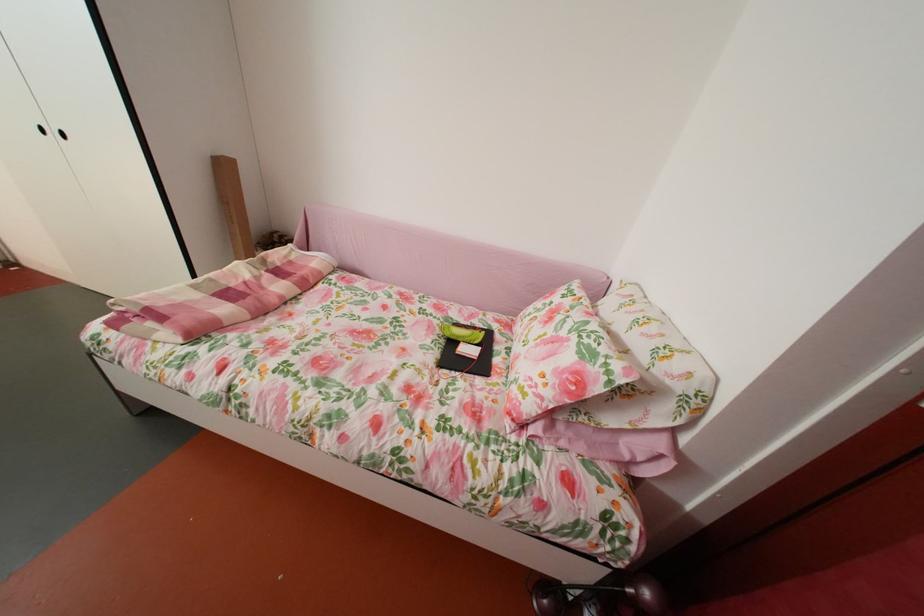
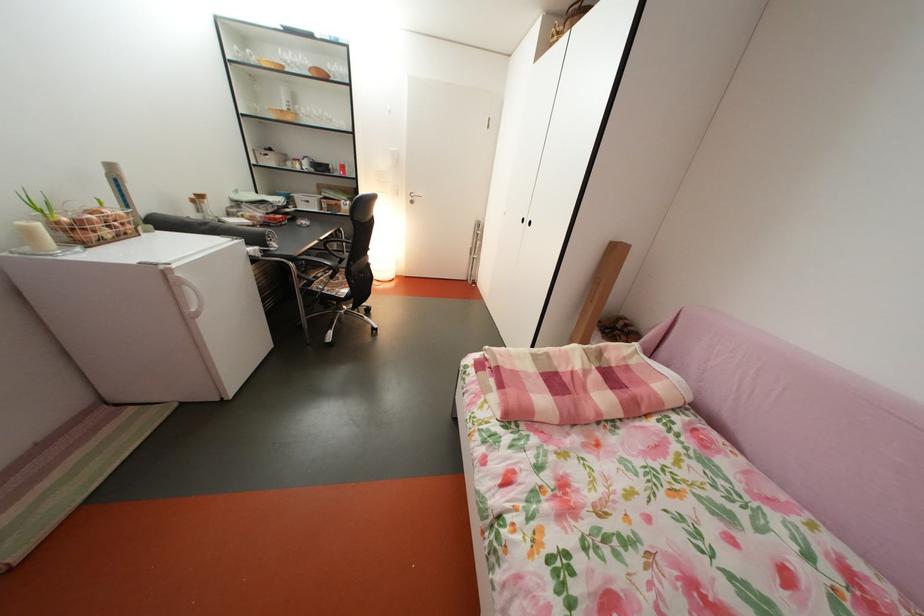
In the second image, find the point that corresponds to (x=274, y=278) in the first image.

(604, 374)